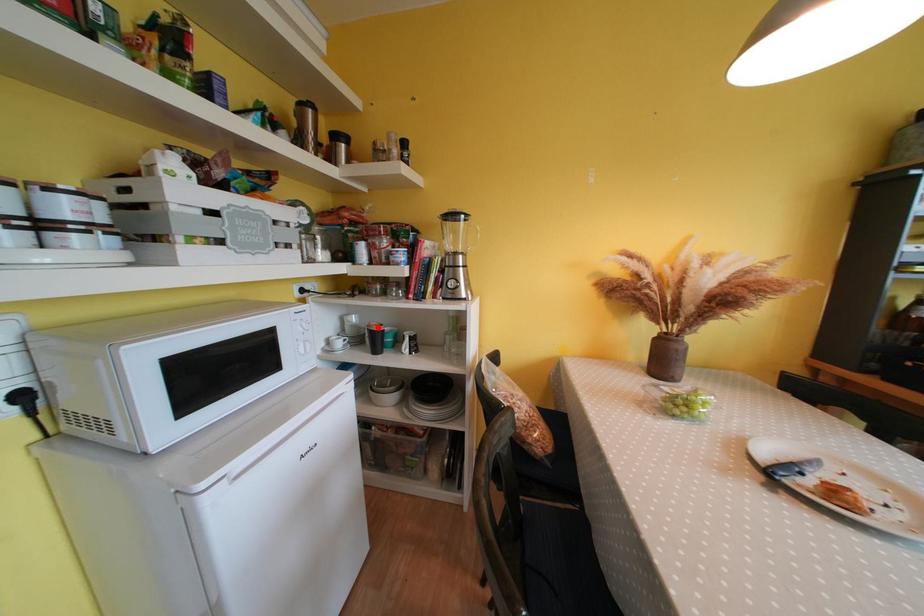
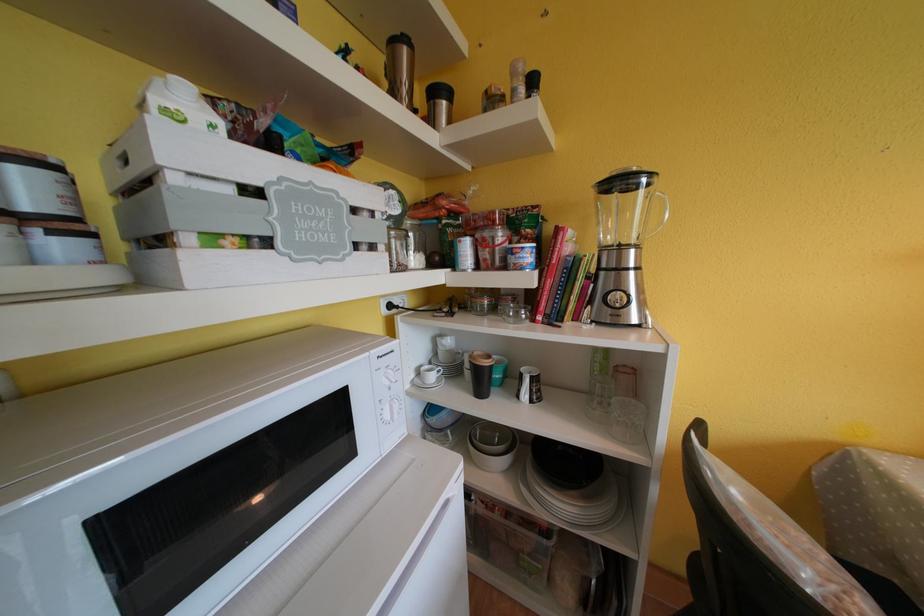
The point at the highlighted location is marked in the first image. Where is the corresponding point in the second image?

(481, 358)